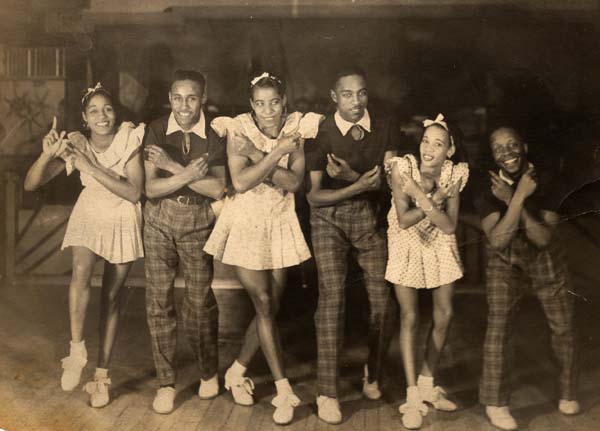
The width and height of the screenshot is (600, 431). In order to click on floor in this screenshot , I will do `click(116, 408)`.